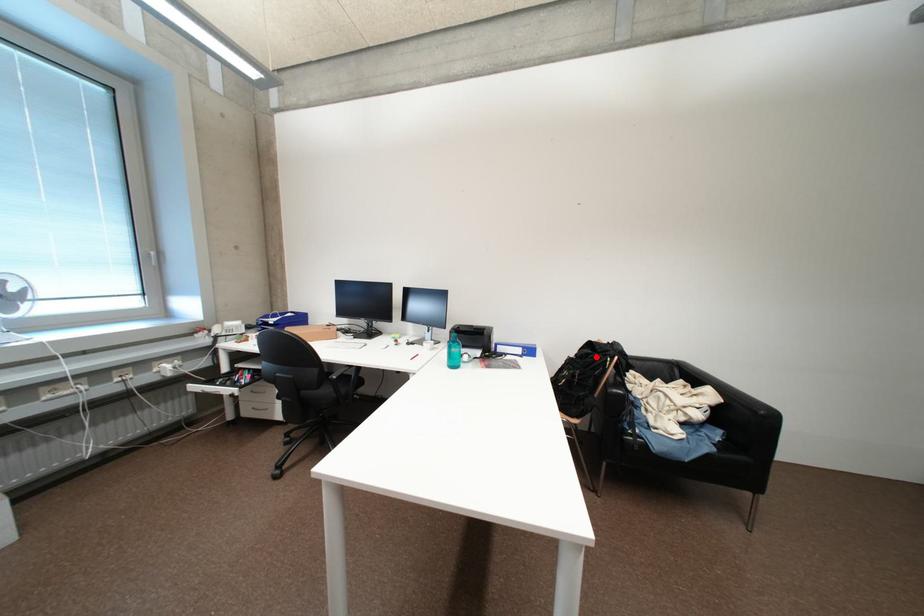
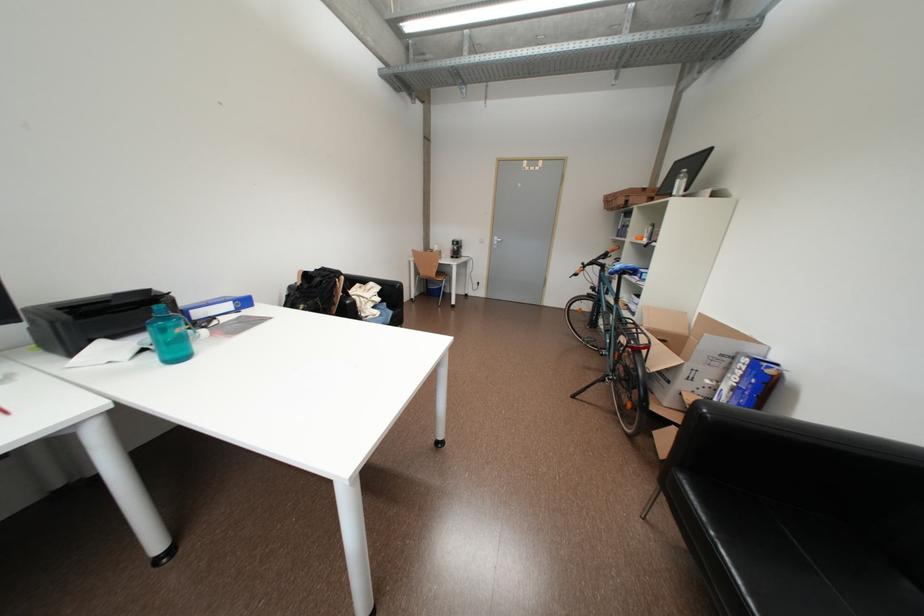
In the second image, find the point that corresponds to the highlighted location in the first image.

(330, 284)